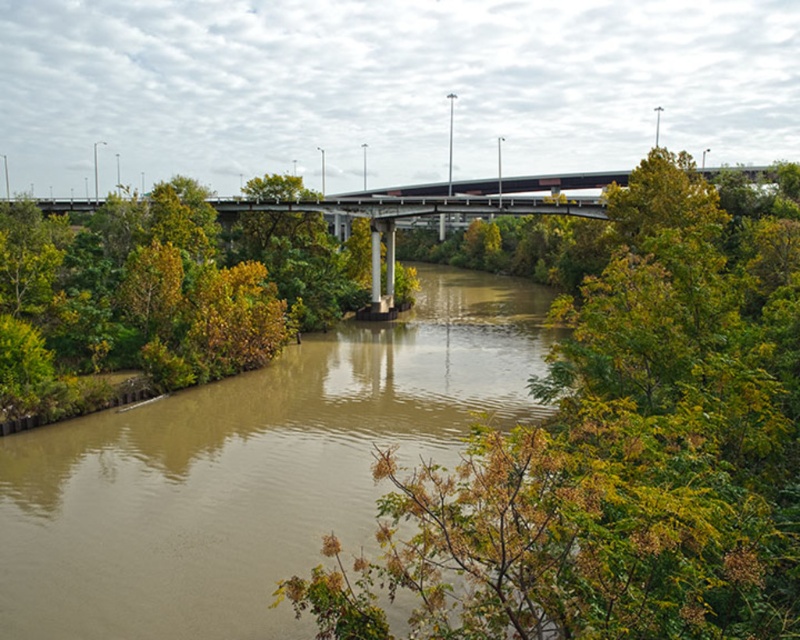
You are standing on the riverside bank and looking at the green leafy tree at center and the brown muddy water at center. Which object is higher in this scene?

The green leafy tree at center is taller than the brown muddy water at center, so the green leafy tree at center is higher in this scene.

You are a photographer planning to capture the green leafy tree at center and the brown muddy water at center in a single frame. Considering their sizes, which object will occupy more space in your photo?

The green leafy tree at center is larger in size than the brown muddy water at center, so it will occupy more space in the photo.

You are standing at the riverside and want to take a photo of the green leafy tree at center. If your camera has a maximum focus range of 6 meters, will you need to adjust your position to capture the tree clearly?

The green leafy tree at center is 6.38 meters away from the viewer. Since the camera can only focus up to 6 meters, you need to move closer to ensure the tree is within the focus range.